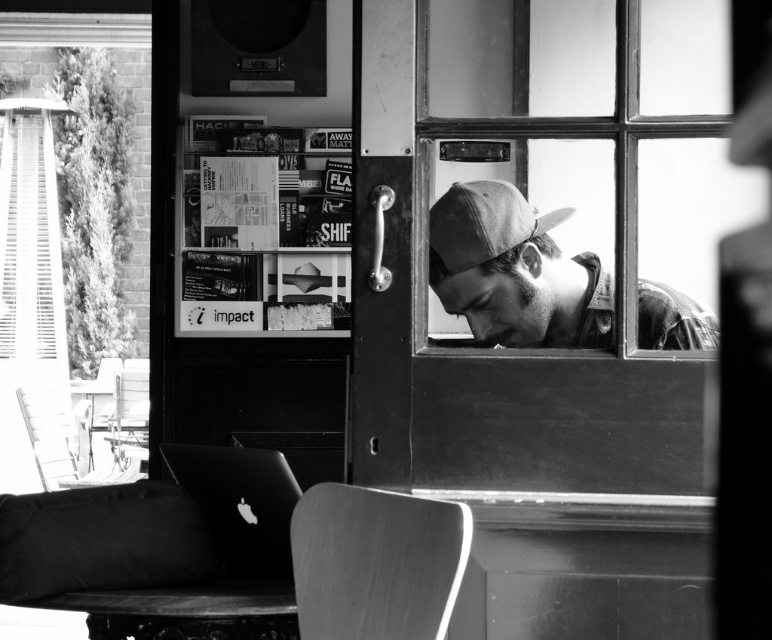
Who is positioned more to the left, smooth wooden table at lower center or matte gray baseball cap at center?

From the viewer's perspective, smooth wooden table at lower center appears more on the left side.

Does smooth wooden table at lower center have a lesser width compared to matte gray baseball cap at center?

No.

You are a GUI agent. You are given a task and a screenshot of the screen. Output one action in this format:
    pyautogui.click(x=<x>, y=<y>)
    Task: Click on the smooth wooden table at lower center
    This screenshot has width=772, height=640.
    Given the screenshot: What is the action you would take?
    pyautogui.click(x=185, y=611)

Is matte brown cap at center thinner than metallic silver laptop at lower left?

Incorrect, matte brown cap at center's width is not less than metallic silver laptop at lower left's.

Does matte brown cap at center have a larger size compared to metallic silver laptop at lower left?

Incorrect, matte brown cap at center is not larger than metallic silver laptop at lower left.

Is point (647, 330) farther from viewer compared to point (259, 488)?

No.

Where is `matte brown cap at center`? This screenshot has height=640, width=772. matte brown cap at center is located at coordinates (513, 272).

Which is behind, point (327, 188) or point (245, 573)?

Positioned behind is point (327, 188).

Can you confirm if printed paper posters at upper center is positioned to the right of metallic silver laptop at lower left?

No, printed paper posters at upper center is not to the right of metallic silver laptop at lower left.

Measure the distance between printed paper posters at upper center and camera.

A distance of 15.70 feet exists between printed paper posters at upper center and camera.

Locate an element on the screen. printed paper posters at upper center is located at coordinates (263, 230).